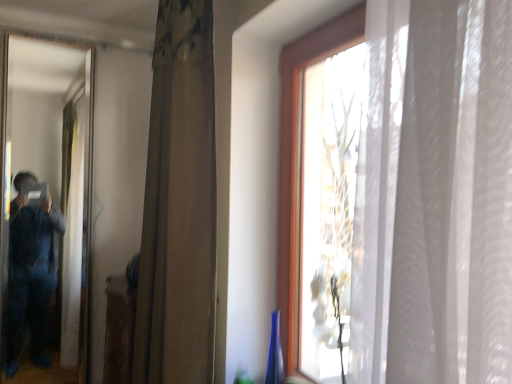
Question: From a real-world perspective, is matte black mirror at left positioned above or below brown textured curtain at center?

Choices:
 (A) below
 (B) above

Answer: (A)

Question: Looking at the image, does matte black mirror at left seem bigger or smaller compared to brown textured curtain at center?

Choices:
 (A) big
 (B) small

Answer: (B)

Question: Does point click(x=36, y=288) appear closer or farther from the camera than point click(x=157, y=218)?

Choices:
 (A) farther
 (B) closer

Answer: (A)

Question: Based on their sizes in the image, would you say brown textured curtain at center is bigger or smaller than matte black mirror at left?

Choices:
 (A) big
 (B) small

Answer: (A)

Question: Is point (166, 177) positioned closer to the camera than point (55, 96)?

Choices:
 (A) farther
 (B) closer

Answer: (B)

Question: Is brown textured curtain at center in front of or behind matte black mirror at left in the image?

Choices:
 (A) behind
 (B) front

Answer: (B)

Question: Is brown textured curtain at center taller or shorter than matte black mirror at left?

Choices:
 (A) short
 (B) tall

Answer: (A)